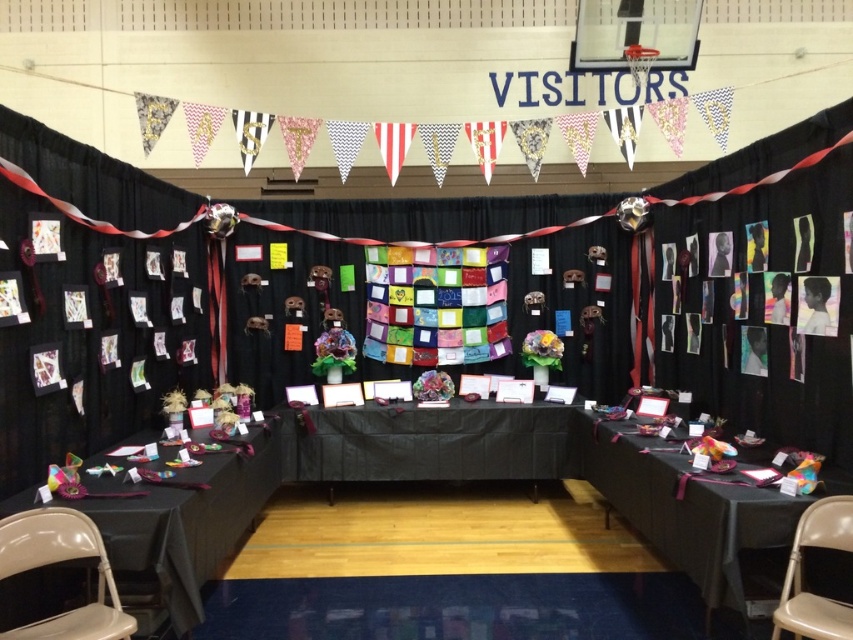
Which is more to the left, shiny metallic decorations at left or beige fabric chair at lower right?

Positioned to the left is shiny metallic decorations at left.

Who is more distant from viewer, (x=195, y=605) or (x=837, y=618)?

Positioned behind is point (x=195, y=605).

Locate an element on the screen. The height and width of the screenshot is (640, 853). shiny metallic decorations at left is located at coordinates (190, 522).

Find the location of `shiny metallic decorations at left`. shiny metallic decorations at left is located at coordinates (190, 522).

Between black fabric table at center and beige fabric chair at lower right, which one is positioned lower?

beige fabric chair at lower right

Which is more to the right, black fabric table at center or beige fabric chair at lower right?

beige fabric chair at lower right

Is point (364, 420) behind point (819, 637)?

Yes, point (364, 420) is farther from viewer.

Locate an element on the screen. The height and width of the screenshot is (640, 853). black fabric table at center is located at coordinates (428, 442).

Does shiny metallic decorations at left come in front of black fabric table at center?

Yes, shiny metallic decorations at left is in front of black fabric table at center.

Does shiny metallic decorations at left have a greater height compared to black fabric table at center?

In fact, shiny metallic decorations at left may be shorter than black fabric table at center.

Is point (49, 586) farther from camera compared to point (323, 413)?

No, it is in front of (323, 413).

The image size is (853, 640). Identify the location of shiny metallic decorations at left. (190, 522).